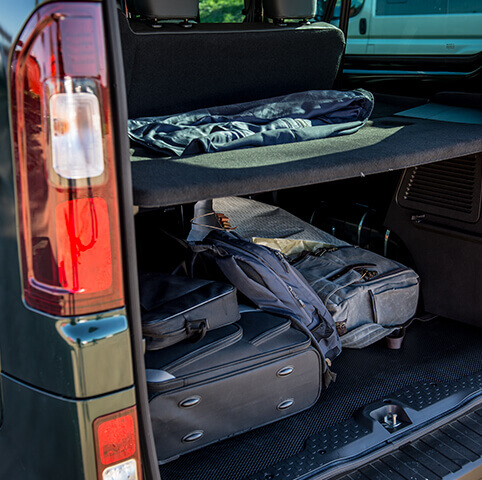
Find the location of a particular element. This screenshot has width=482, height=480. blanket is located at coordinates (236, 121).